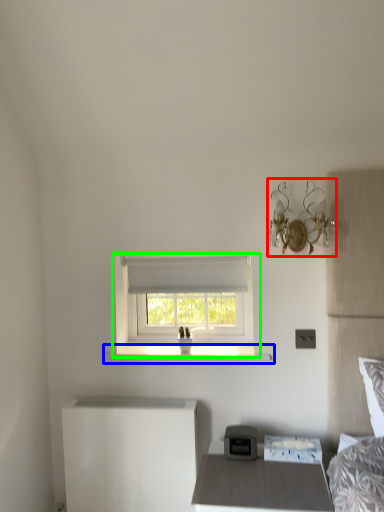
Question: Considering the real-world distances, which object is farthest from light fixture (highlighted by a red box)? window sill (highlighted by a blue box) or window (highlighted by a green box)?

Choices:
 (A) window sill
 (B) window

Answer: (A)